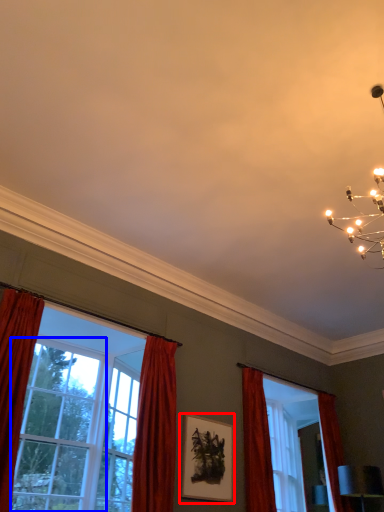
Question: Which point is closer to the camera, picture frame (highlighted by a red box) or window (highlighted by a blue box)?

Choices:
 (A) picture frame
 (B) window

Answer: (B)